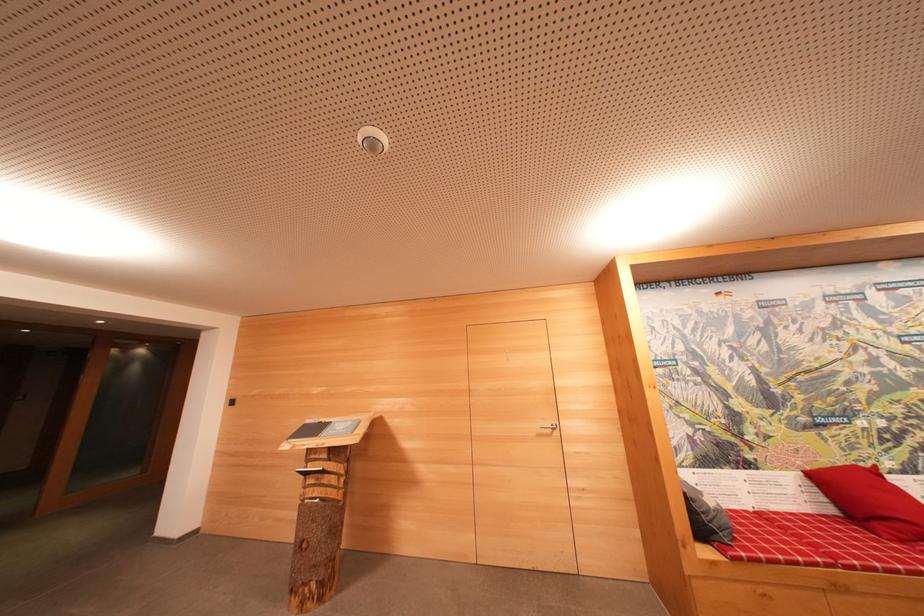
Where would you turn the silver door handle? Please return your answer as a coordinate pair (x, y).

(551, 427)